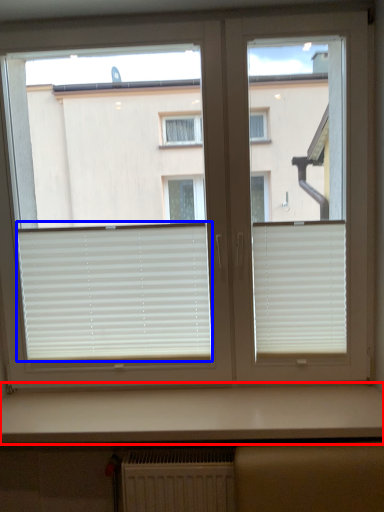
Question: Among these objects, which one is nearest to the camera, counter top (highlighted by a red box) or window blind (highlighted by a blue box)?

Choices:
 (A) counter top
 (B) window blind

Answer: (A)